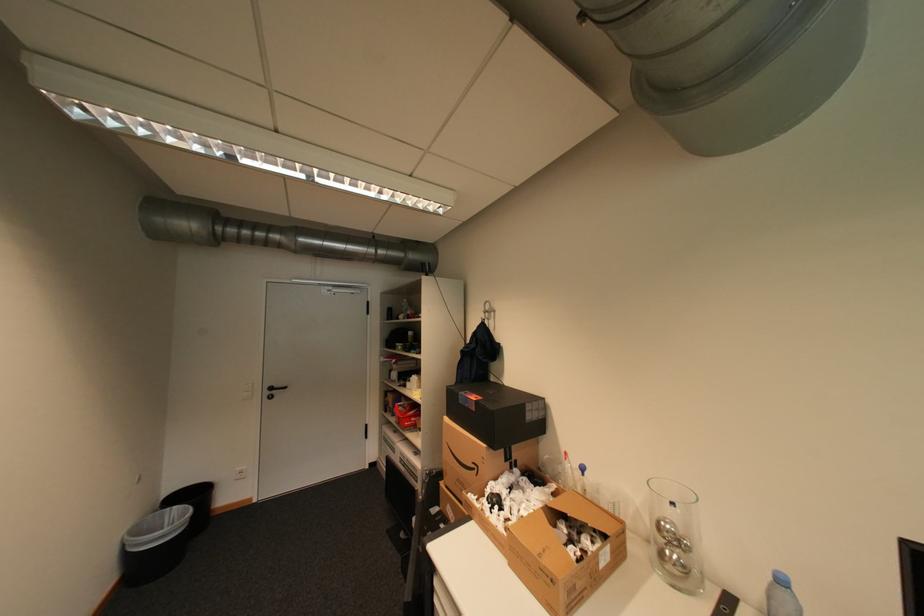
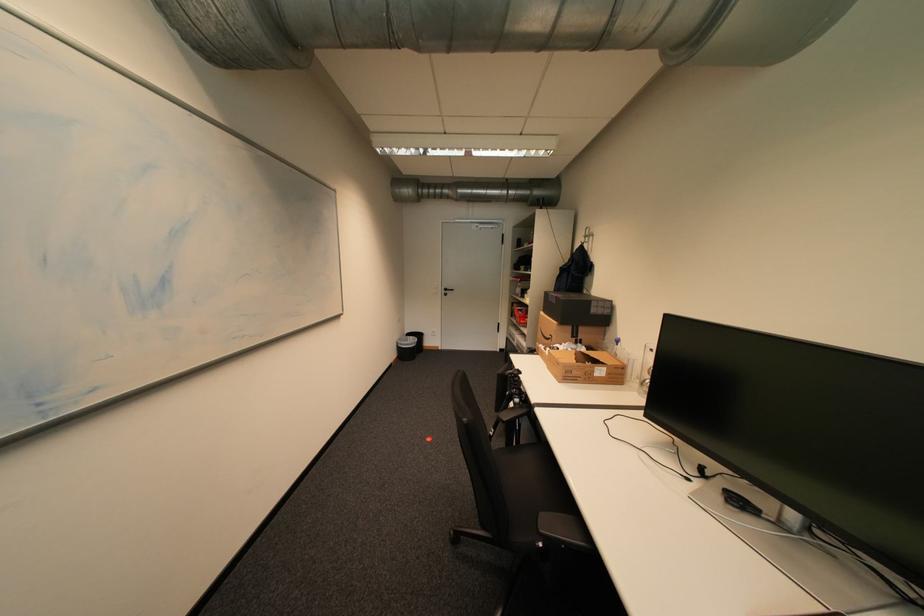
Question: The first image is from the beginning of the video and the second image is from the end. How did the camera likely rotate when shooting the video?

Choices:
 (A) Left
 (B) Right
 (C) Up
 (D) Down

Answer: (A)